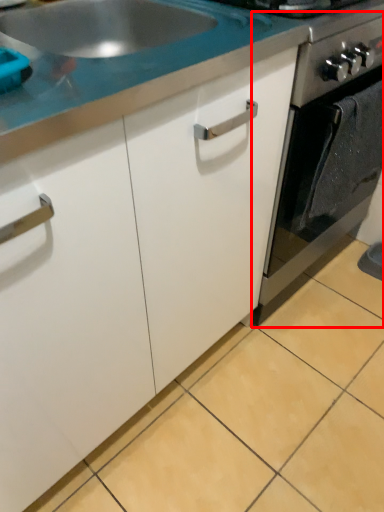
Question: In this image, where is oven (annotated by the red box) located relative to countertop?

Choices:
 (A) left
 (B) right

Answer: (B)